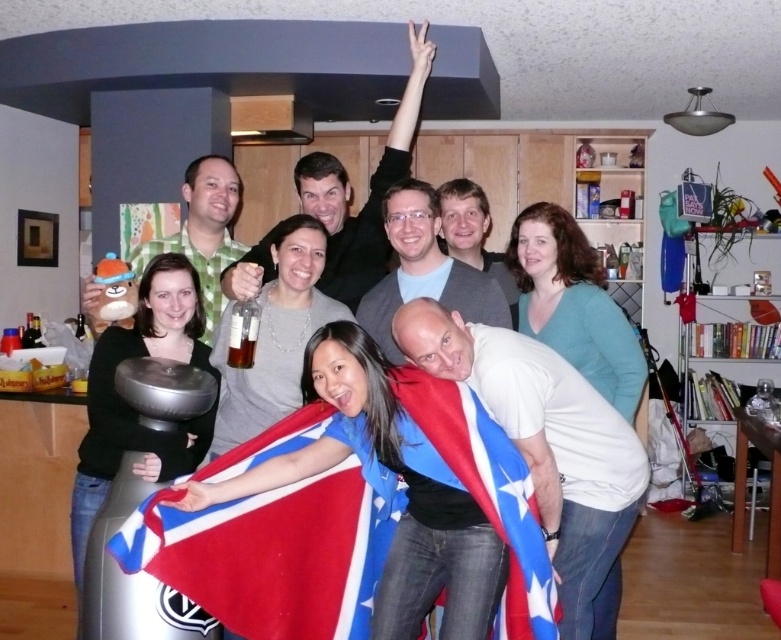
Question: Which point is farther from the camera taking this photo?

Choices:
 (A) (284, 288)
 (B) (129, 516)

Answer: (A)

Question: Does red and white fabric flag at center have a greater width compared to translucent glass bottle at center?

Choices:
 (A) yes
 (B) no

Answer: (A)

Question: Which of the following is the farthest from the observer?

Choices:
 (A) red fabric flag at center
 (B) translucent glass bottle at center
 (C) matte gray sweater at center
 (D) matte black shirt at upper center

Answer: (D)

Question: Does matte gray sweater at center appear on the right side of matte black shirt at upper center?

Choices:
 (A) no
 (B) yes

Answer: (A)

Question: Is red fabric flag at center bigger than red and white fabric flag at center?

Choices:
 (A) yes
 (B) no

Answer: (B)

Question: Among these points, which one is nearest to the camera?

Choices:
 (A) (530, 545)
 (B) (214, 445)
 (C) (308, 412)

Answer: (A)